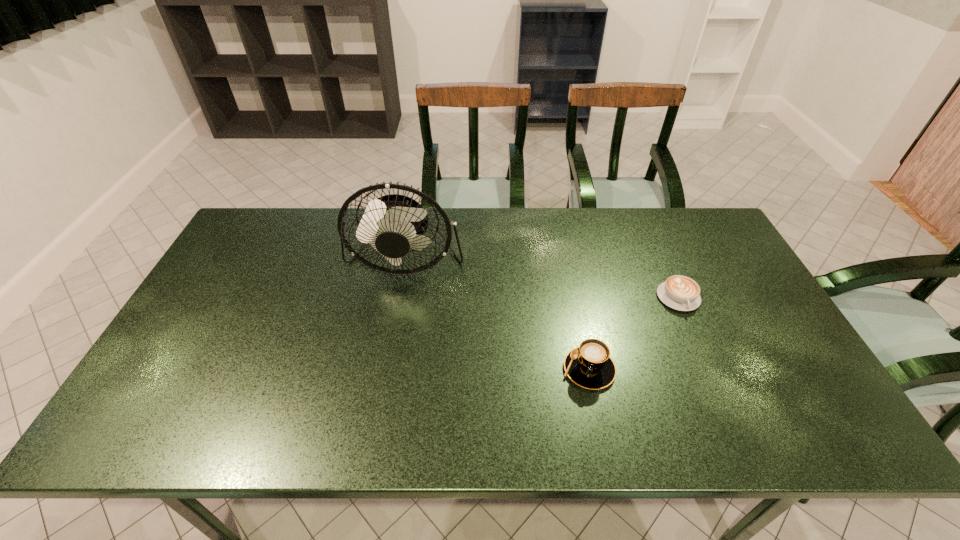
At what (x,y) coordinates should I click in order to perform the action: click on free space between the leftmost object and the nearest object. Please return your answer as a coordinate pair (x, y). This screenshot has height=540, width=960. Looking at the image, I should click on (497, 314).

This screenshot has height=540, width=960. I want to click on unoccupied position between the fan and the nearer cappuccino, so click(x=497, y=314).

The width and height of the screenshot is (960, 540). I want to click on free spot between the rightmost object and the leftmost object, so (542, 279).

Locate an element on the screen. vacant space in between the leftmost object and the nearest object is located at coordinates (497, 314).

Find the location of a particular element. This screenshot has width=960, height=540. object that is the closest to the tallest object is located at coordinates (590, 366).

This screenshot has width=960, height=540. I want to click on object that is the nearest to the fan, so click(590, 366).

This screenshot has height=540, width=960. I want to click on free space that satisfies the following two spatial constraints: 1. in front of the leftmost object, directing airflow; 2. on the left side of the second tallest object, so click(386, 369).

Locate an element on the screen. free point that satisfies the following two spatial constraints: 1. in front of the fan, directing airflow; 2. on the left side of the nearer cappuccino is located at coordinates (386, 369).

Find the location of a particular element. The height and width of the screenshot is (540, 960). free space that satisfies the following two spatial constraints: 1. in front of the tallest object, directing airflow; 2. on the left side of the left cappuccino is located at coordinates (386, 369).

Where is `vacant space that satisfies the following two spatial constraints: 1. in front of the leftmost object, directing airflow; 2. on the right side of the nearest object`? This screenshot has height=540, width=960. vacant space that satisfies the following two spatial constraints: 1. in front of the leftmost object, directing airflow; 2. on the right side of the nearest object is located at coordinates click(386, 369).